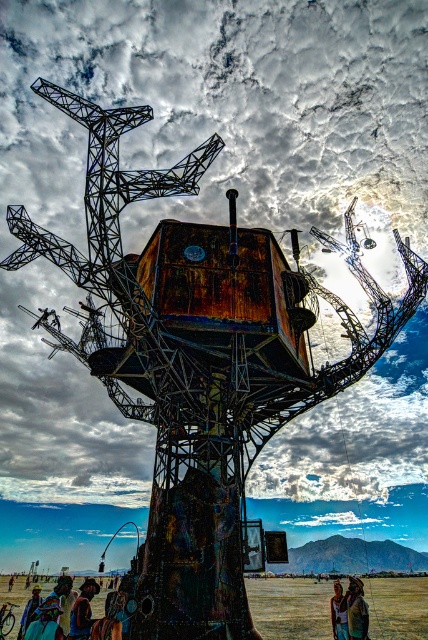
Does brown leather jacket at lower right have a greater width compared to denim jacket at lower left?

In fact, brown leather jacket at lower right might be narrower than denim jacket at lower left.

What do you see at coordinates (356, 611) in the screenshot? I see `brown leather jacket at lower right` at bounding box center [356, 611].

Where is `brown leather jacket at lower right`? brown leather jacket at lower right is located at coordinates (356, 611).

Between blue fabric person at lower left and denim jacket at lower left, which one appears on the right side from the viewer's perspective?

From the viewer's perspective, blue fabric person at lower left appears more on the right side.

The height and width of the screenshot is (640, 428). I want to click on blue fabric person at lower left, so click(45, 620).

Is blue fabric person at lower left to the left of brushed metal person at lower left from the viewer's perspective?

No, blue fabric person at lower left is not to the left of brushed metal person at lower left.

Is blue fabric person at lower left wider than brushed metal person at lower left?

Indeed, blue fabric person at lower left has a greater width compared to brushed metal person at lower left.

Find the location of `blue fabric person at lower left`. blue fabric person at lower left is located at coordinates (45, 620).